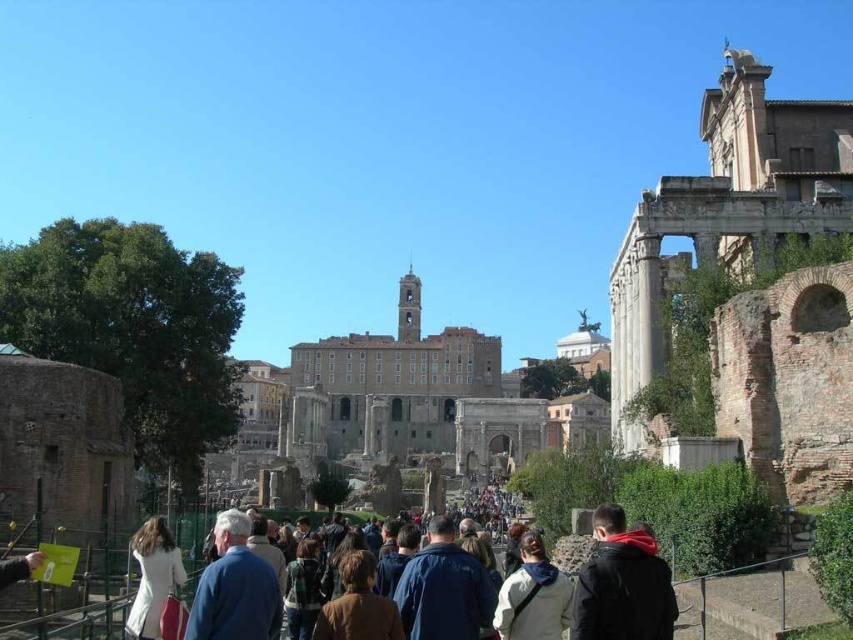
Question: Which object is positioned farthest from the dark blue jacket at center?

Choices:
 (A) green plaid shirt at center
 (B) white matte coat at lower left
 (C) brown leather jacket at center

Answer: (B)

Question: Considering the real-world distances, which object is closest to the dark blue jacket at lower right?

Choices:
 (A) blue fabric jacket at center
 (B) white cotton jacket at center
 (C) white matte coat at lower left
 (D) dark blue jacket at center

Answer: (D)

Question: Which object is closer to the camera taking this photo?

Choices:
 (A) blue fabric jacket at center
 (B) brown leather jacket at center

Answer: (A)

Question: Is white cotton jacket at center in front of green plaid shirt at center?

Choices:
 (A) no
 (B) yes

Answer: (B)

Question: Does white cotton jacket at center have a lesser width compared to brown leather jacket at center?

Choices:
 (A) no
 (B) yes

Answer: (B)

Question: Does dark blue jacket at lower right have a lesser width compared to blue fabric jacket at center?

Choices:
 (A) yes
 (B) no

Answer: (A)